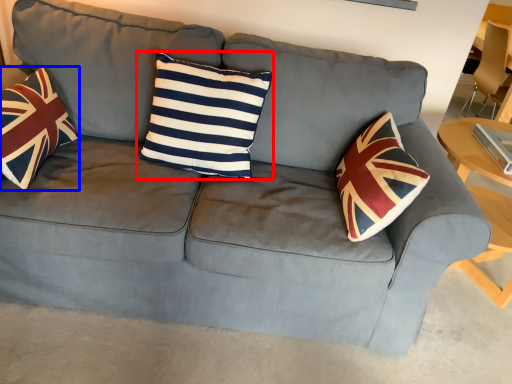
Question: Which point is further to the camera, pillow (highlighted by a red box) or throw pillow (highlighted by a blue box)?

Choices:
 (A) pillow
 (B) throw pillow

Answer: (A)